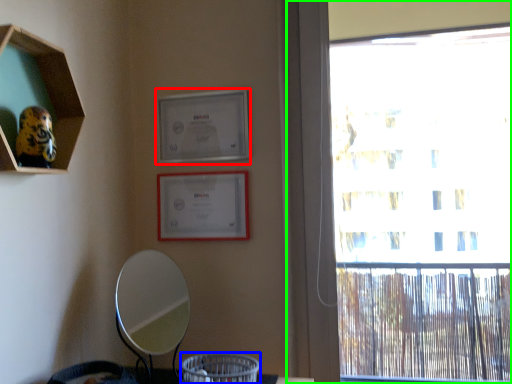
Question: Estimate the real-world distances between objects in this image. Which object is farther from picture frame (highlighted by a red box), basket (highlighted by a blue box) or window (highlighted by a green box)?

Choices:
 (A) basket
 (B) window

Answer: (B)